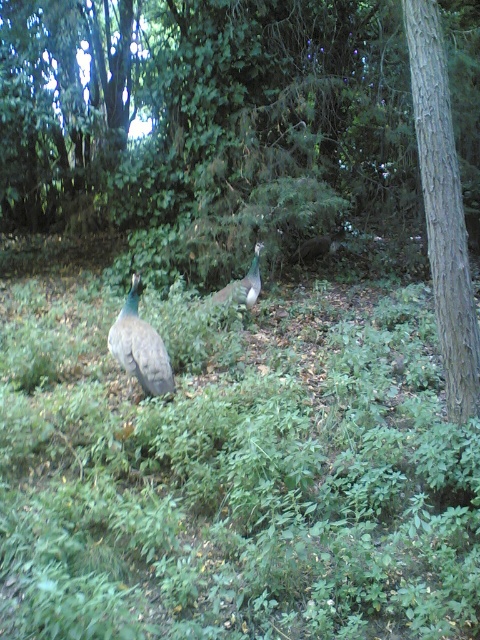
Between green leafy grass at center and green iridescent peacock at center, which one is positioned lower?

green leafy grass at center is lower down.

Who is more forward, (164,445) or (235,294)?

Point (164,445) is in front.

Identify the location of green leafy grass at center. (233, 472).

Is brown textured tree at center right below brown rough tree trunk at right?

Incorrect, brown textured tree at center right is not positioned below brown rough tree trunk at right.

Does brown textured tree at center right appear on the right side of brown rough tree trunk at right?

No, brown textured tree at center right is not to the right of brown rough tree trunk at right.

Does point (464, 392) come behind point (428, 145)?

No, (464, 392) is in front of (428, 145).

You are a GUI agent. You are given a task and a screenshot of the screen. Output one action in this format:
    pyautogui.click(x=<x>, y=<y>)
    Task: Click on the brown textured tree at center right
    The width and height of the screenshot is (480, 640).
    Given the screenshot: What is the action you would take?
    pyautogui.click(x=244, y=132)

In the scene shown: Who is positioned more to the left, shiny green peacock at center or green iridescent peacock at center?

shiny green peacock at center is more to the left.

Identify the location of shiny green peacock at center. This screenshot has height=640, width=480. (140, 346).